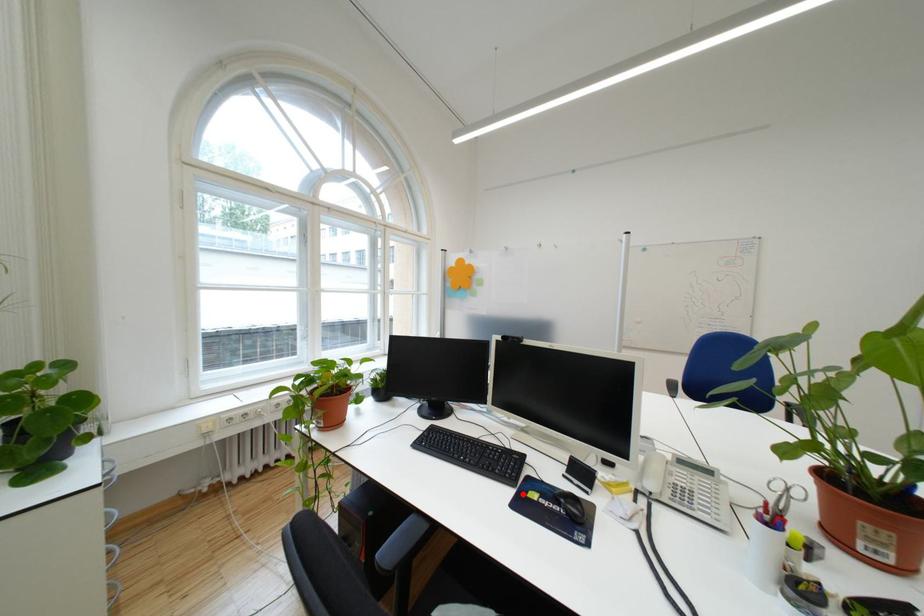
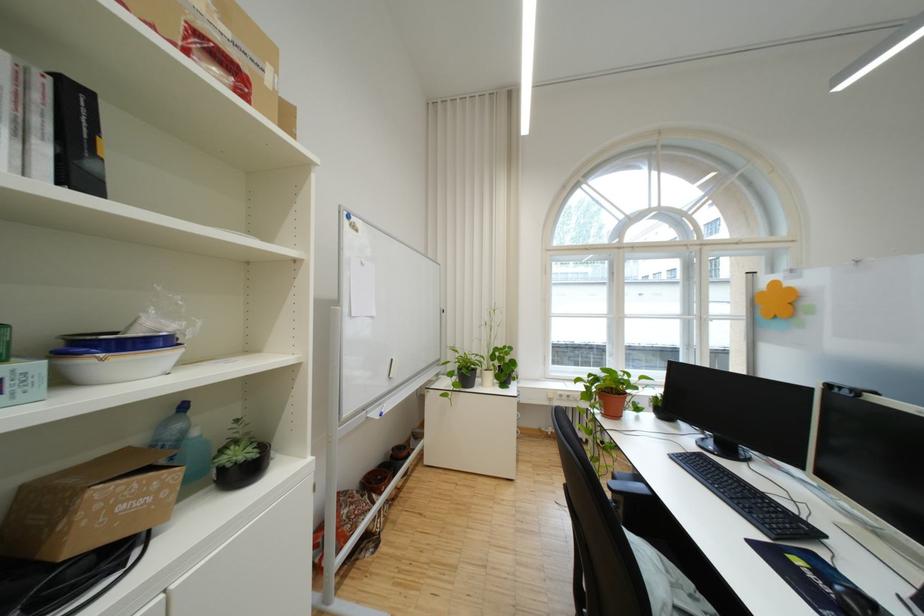
The point at the highlighted location is marked in the first image. Where is the corresponding point in the second image?

(772, 539)